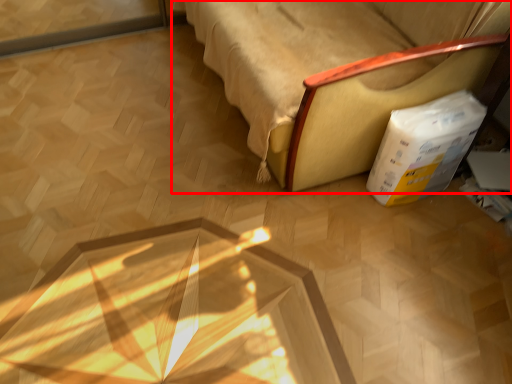
Question: From the image's perspective, what is the correct spatial positioning of furniture (annotated by the red box) in reference to cardboard box?

Choices:
 (A) below
 (B) above

Answer: (B)